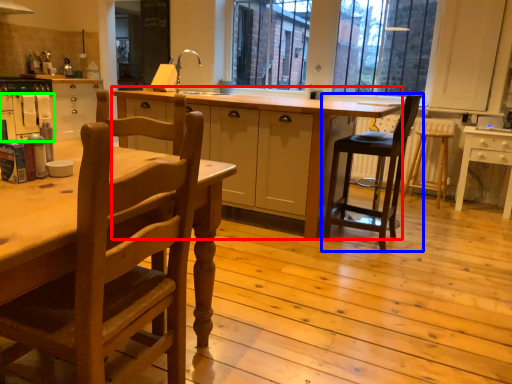
Question: Which object is the closest to the table (highlighted by a red box)? Choose among these: chair (highlighted by a blue box) or oven (highlighted by a green box).

Choices:
 (A) chair
 (B) oven

Answer: (A)